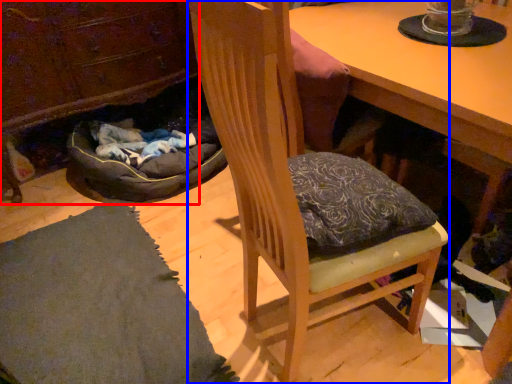
Question: Which point is further to the camera, cabinetry (highlighted by a red box) or chair (highlighted by a blue box)?

Choices:
 (A) cabinetry
 (B) chair

Answer: (A)